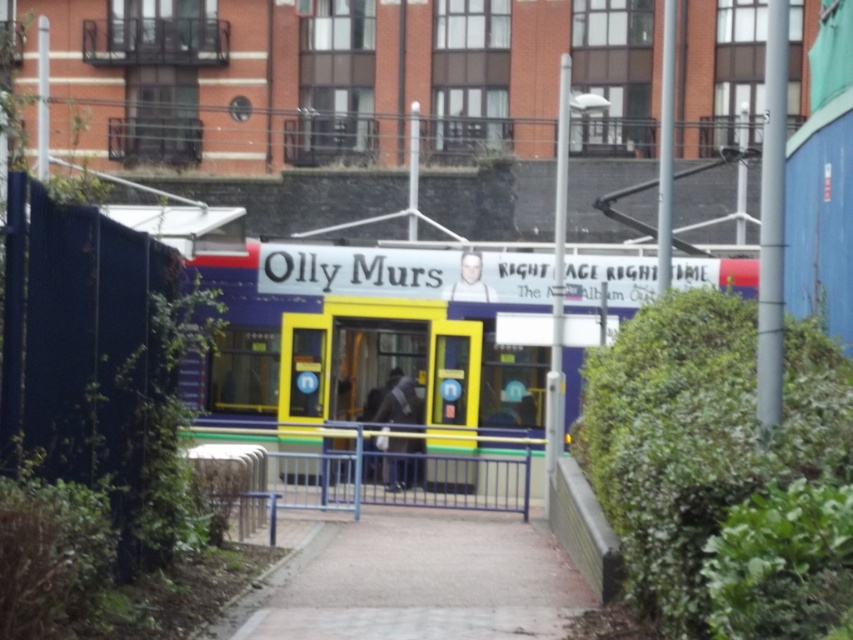
Where is `yellow plastic train at center`? This screenshot has height=640, width=853. yellow plastic train at center is located at coordinates (376, 333).

Is yellow plastic train at center shorter than blue metallic rail at center?

Correct, yellow plastic train at center is not as tall as blue metallic rail at center.

Locate an element on the screen. The width and height of the screenshot is (853, 640). yellow plastic train at center is located at coordinates (376, 333).

Which is more to the left, paved concrete pavement at center or blue metallic rail at center?

Positioned to the left is paved concrete pavement at center.

I want to click on paved concrete pavement at center, so click(422, 580).

Between point (595, 300) and point (474, 612), which one is positioned behind?

The point (595, 300) is behind.

This screenshot has width=853, height=640. In order to click on yellow plastic train at center in this screenshot , I will do `click(376, 333)`.